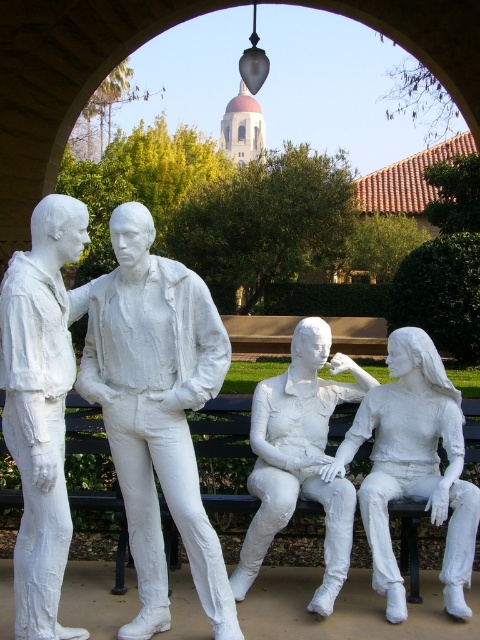
You are a person who is 5 feet tall. You want to sit on the black painted wood bench at center while also being able to see the white matte statue at center without moving. Is this possible?

The white matte statue at center and the black painted wood bench at center are 3.86 feet apart, so yes, a person who is 5 feet tall can sit on the black painted wood bench at center and still see the white matte statue at center without needing to move, as the distance between them is within the person s line of sight.

You are an art student who wants to create a scale model of the two statues. The white plaster figure at left and the white matte statue at center. Which one should you make taller in your model?

The white plaster figure at left should be made taller in the model since it is taller than the white matte statue at center according to the description.